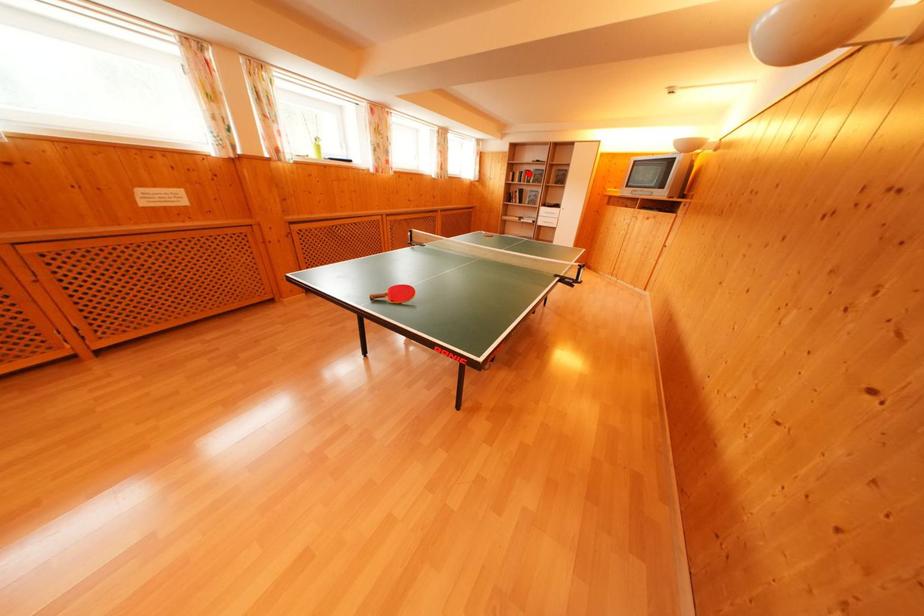
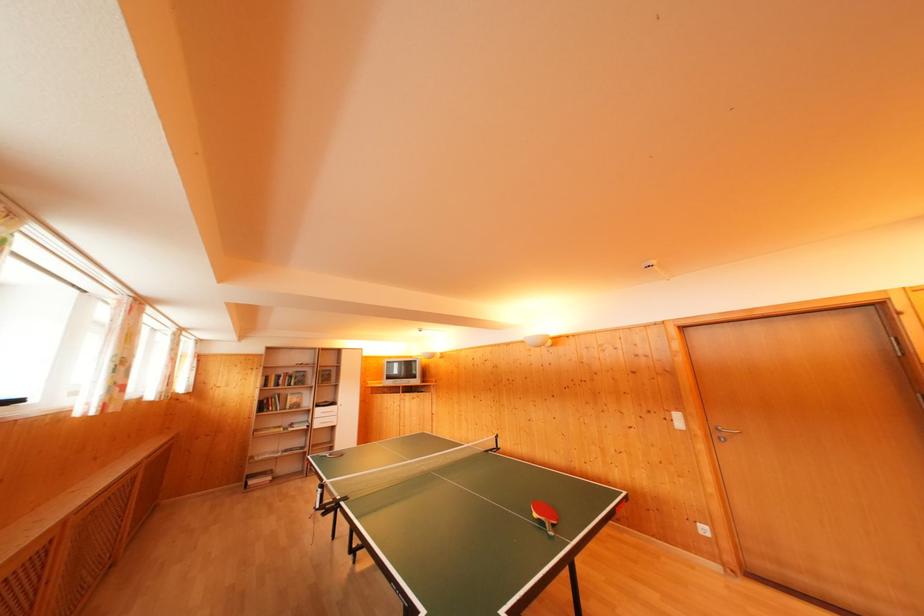
Question: I am providing you with two images of the same scene from different viewpoints. In image1, a red point is highlighted. Considering the same 3D point in image2, which of the following is correct?

Choices:
 (A) It is closer
 (B) It is farther

Answer: (B)